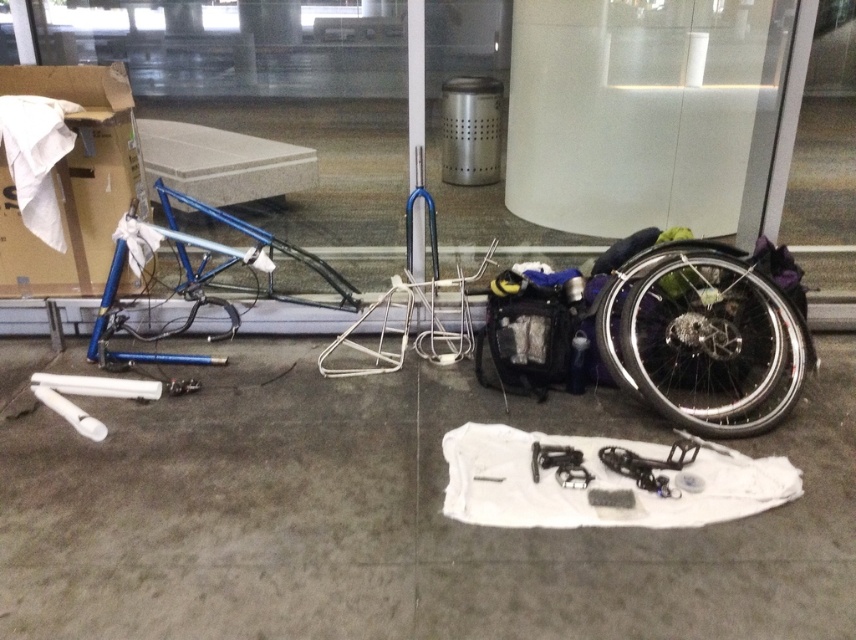
Question: Can you confirm if black metallic wheelchair tire at lower right is positioned below white glossy pillar at center?

Choices:
 (A) no
 (B) yes

Answer: (B)

Question: Which point appears closest to the camera in this image?

Choices:
 (A) [x=415, y=115]
 (B) [x=43, y=284]
 (C) [x=536, y=272]
 (D) [x=684, y=344]

Answer: (D)

Question: Is blue metallic bicycle frame at left to the right of white glossy pillar at center from the viewer's perspective?

Choices:
 (A) yes
 (B) no

Answer: (A)

Question: Which object appears farthest from the camera in this image?

Choices:
 (A) blue metallic bicycle frame at left
 (B) white glossy pillar at center
 (C) brown cardboard at upper left

Answer: (B)

Question: In this image, where is blue metallic bicycle frame at left located relative to brown cardboard at upper left?

Choices:
 (A) right
 (B) left

Answer: (A)

Question: Which point is closer to the camera?

Choices:
 (A) white glossy pillar at center
 (B) blue metallic bicycle frame at left
 (C) brown cardboard at upper left

Answer: (B)